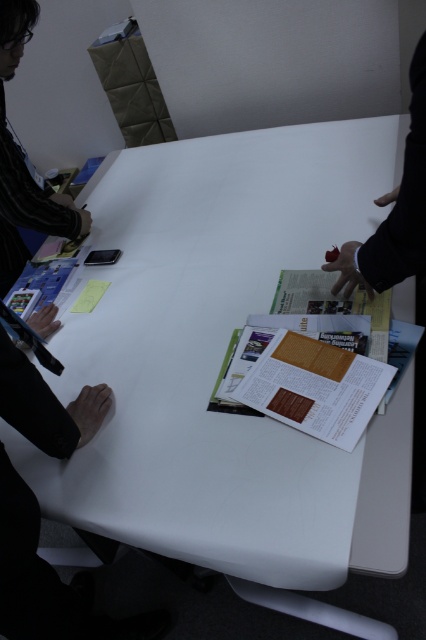
Question: Observing the image, what is the correct spatial positioning of black fabric hand at right in reference to striped shirt at left?

Choices:
 (A) right
 (B) left

Answer: (A)

Question: Which of the following is the closest to the observer?

Choices:
 (A) (258, 381)
 (B) (8, 273)
 (C) (350, 243)

Answer: (A)

Question: Considering the relative positions of white glossy paper at center and striped shirt at left in the image provided, where is white glossy paper at center located with respect to striped shirt at left?

Choices:
 (A) left
 (B) right

Answer: (B)

Question: Which of these objects is positioned closest to the white glossy paper at center?

Choices:
 (A) black fabric hand at right
 (B) striped shirt at left

Answer: (A)

Question: Which point appears farthest from the camera in this image?

Choices:
 (A) 17,237
 (B) 397,243

Answer: (A)

Question: Is black fabric hand at right smaller than striped shirt at left?

Choices:
 (A) yes
 (B) no

Answer: (A)